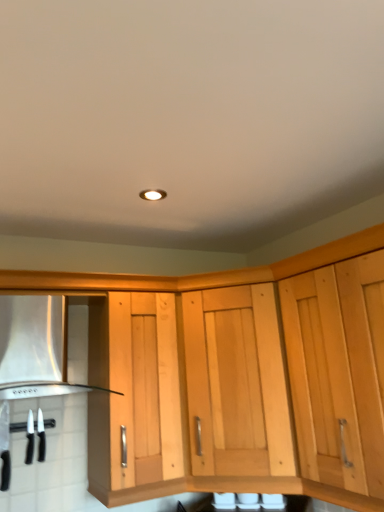
Question: Considering the relative positions of black plastic knife at lower left, placed as the second kitchen appliance when sorted from left to right, and black plastic knives at lower left, which is counted as the 1th kitchen appliance, starting from the left, in the image provided, is black plastic knife at lower left, placed as the second kitchen appliance when sorted from left to right, behind black plastic knives at lower left, which is counted as the 1th kitchen appliance, starting from the left,?

Choices:
 (A) yes
 (B) no

Answer: (A)

Question: Considering the relative sizes of black plastic knife at lower left, the 1th kitchen appliance from the right, and black plastic knives at lower left, which is counted as the 1th kitchen appliance, starting from the left, in the image provided, is black plastic knife at lower left, the 1th kitchen appliance from the right, bigger than black plastic knives at lower left, which is counted as the 1th kitchen appliance, starting from the left,?

Choices:
 (A) no
 (B) yes

Answer: (A)

Question: Can black plastic knives at lower left, which is counted as the 1th kitchen appliance, starting from the left, be found inside black plastic knife at lower left, placed as the second kitchen appliance when sorted from left to right?

Choices:
 (A) yes
 (B) no

Answer: (B)

Question: Considering the relative sizes of black plastic knife at lower left, the 1th kitchen appliance from the right, and black plastic knives at lower left, which is counted as the 1th kitchen appliance, starting from the left, in the image provided, is black plastic knife at lower left, the 1th kitchen appliance from the right, taller than black plastic knives at lower left, which is counted as the 1th kitchen appliance, starting from the left,?

Choices:
 (A) no
 (B) yes

Answer: (A)

Question: From a real-world perspective, is black plastic knife at lower left, the 1th kitchen appliance from the right, positioned over black plastic knives at lower left, marked as the second kitchen appliance in a right-to-left arrangement, based on gravity?

Choices:
 (A) no
 (B) yes

Answer: (B)

Question: Does black plastic knife at lower left, placed as the second kitchen appliance when sorted from left to right, have a lesser width compared to black plastic knives at lower left, marked as the second kitchen appliance in a right-to-left arrangement?

Choices:
 (A) yes
 (B) no

Answer: (A)

Question: Is natural wood cabinet at center far from black plastic knife at lower left, the 1th kitchen appliance from the right?

Choices:
 (A) no
 (B) yes

Answer: (A)

Question: Is the surface of natural wood cabinet at center in direct contact with black plastic knife at lower left, the 1th kitchen appliance from the right?

Choices:
 (A) no
 (B) yes

Answer: (A)

Question: Does natural wood cabinet at center have a smaller size compared to black plastic knife at lower left, the 1th kitchen appliance from the right?

Choices:
 (A) no
 (B) yes

Answer: (A)

Question: Can you confirm if natural wood cabinet at center is taller than black plastic knife at lower left, the 1th kitchen appliance from the right?

Choices:
 (A) yes
 (B) no

Answer: (A)

Question: Could you tell me if natural wood cabinet at center is facing black plastic knife at lower left, the 1th kitchen appliance from the right?

Choices:
 (A) yes
 (B) no

Answer: (B)

Question: Does natural wood cabinet at center come behind black plastic knife at lower left, the 1th kitchen appliance from the right?

Choices:
 (A) yes
 (B) no

Answer: (B)

Question: Is black plastic knife at lower left, the 1th kitchen appliance from the right, outside of natural wood cabinet at center?

Choices:
 (A) no
 (B) yes

Answer: (B)